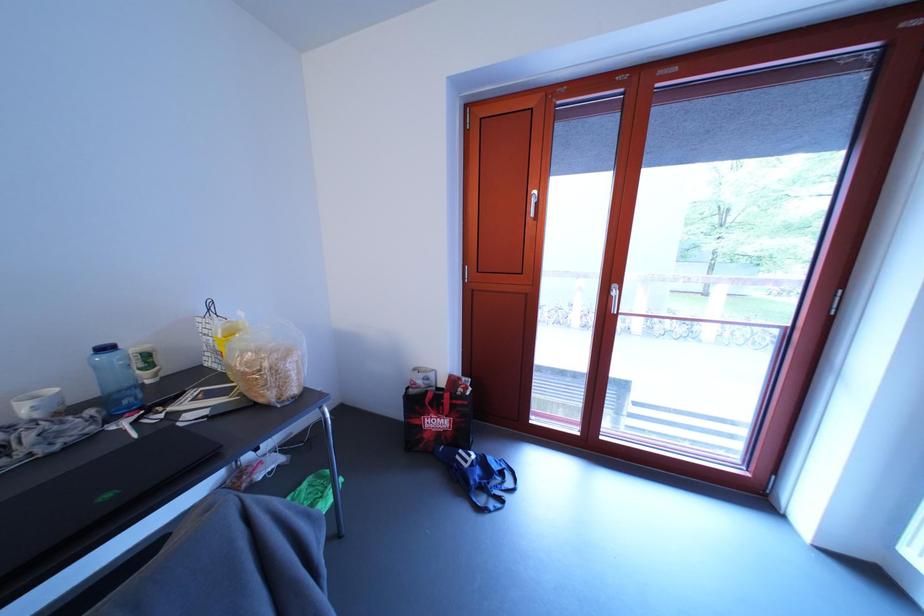
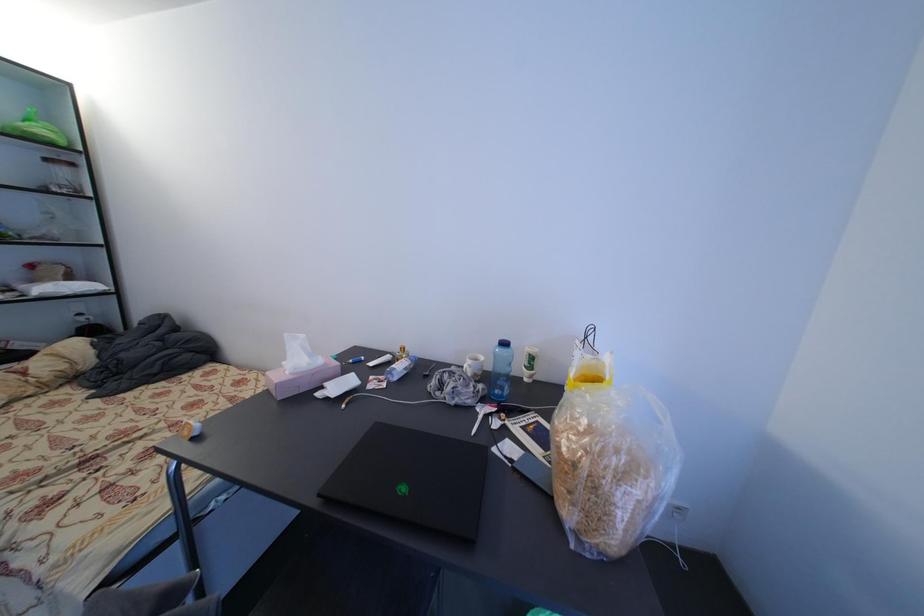
Question: The images are taken continuously from a first-person perspective. In which direction is your viewpoint rotating?

Choices:
 (A) Left
 (B) Right
 (C) Up
 (D) Down

Answer: (A)